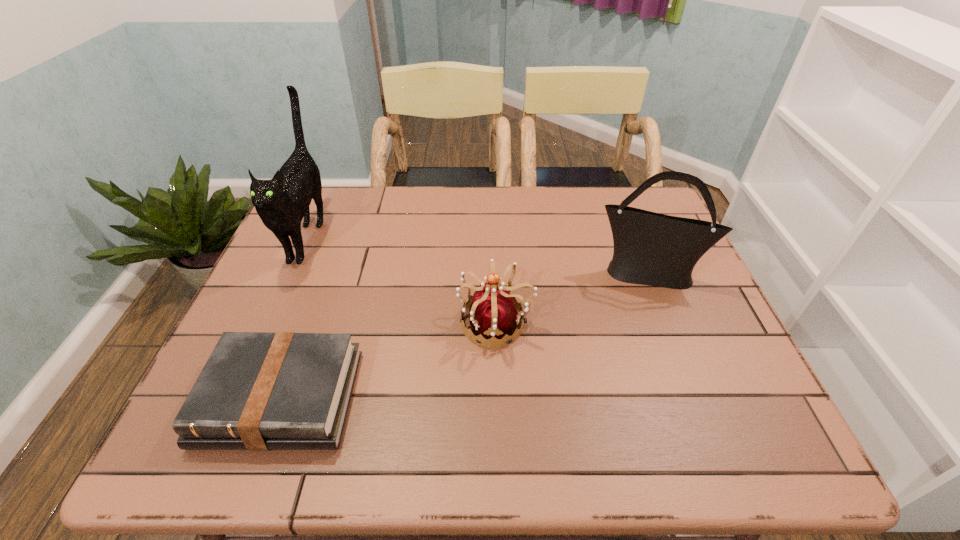
Identify the location of free space between the cat and the hardback book. (295, 317).

Locate an element on the screen. Image resolution: width=960 pixels, height=540 pixels. free spot between the tiara and the rightmost object is located at coordinates (570, 298).

You are a GUI agent. You are given a task and a screenshot of the screen. Output one action in this format:
    pyautogui.click(x=<x>, y=<y>)
    Task: Click on the free space between the cat and the hardback book
    
    Given the screenshot: What is the action you would take?
    pyautogui.click(x=295, y=317)

Locate an element on the screen. Image resolution: width=960 pixels, height=540 pixels. vacant area that lies between the tiara and the tallest object is located at coordinates (402, 279).

What are the coordinates of `object that is the third nearest to the second tallest object` in the screenshot? It's located at (282, 202).

Where is `the closest object to the third object from left to right`? The image size is (960, 540). the closest object to the third object from left to right is located at coordinates (653, 249).

Identify the location of free region that satisfies the following two spatial constraints: 1. on the face of the cat; 2. on the right side of the second tallest object. Image resolution: width=960 pixels, height=540 pixels. (292, 273).